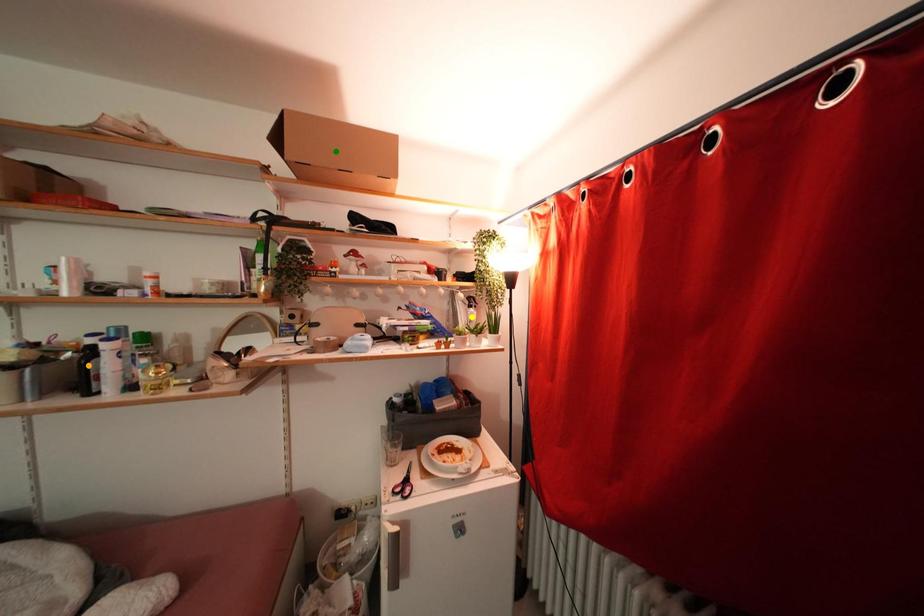
Order these from nearest to farthest:
A) orange point
B) green point
C) yellow point

orange point < green point < yellow point